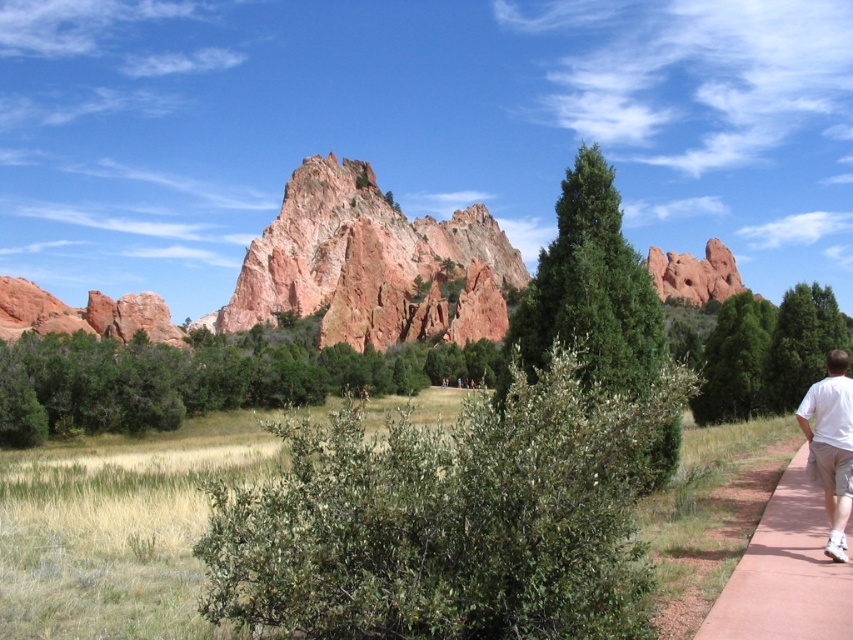
You are standing at the entrance of the scenic outdoor landscape and want to take a photo of both the green leafy tree at center and the red concrete sidewalk at lower right in the same frame. Based on their positions, which object should you position closer to the left side of your camera view to include both in the shot?

You should position the green leafy tree at center closer to the left side of your camera view since it is already to the left of the red concrete sidewalk at lower right.

You are planning to take a photo of both the rustic sandstone rock formation at center and the green leafy tree at center. Which object should you focus on first if you want to capture both in a single frame without moving the camera?

You should focus on the rustic sandstone rock formation at center first because it is wider than the green leafy tree at center, allowing you to frame it properly while ensuring the tree fits into the shot.

You are planning to take a photo of the rustic sandstone rock formation at center and the green leafy tree at center from a position where both are visible. Which object will appear closer to the camera in the photo?

The rustic sandstone rock formation at center will appear closer to the camera because it is larger in size than the green leafy tree at center.